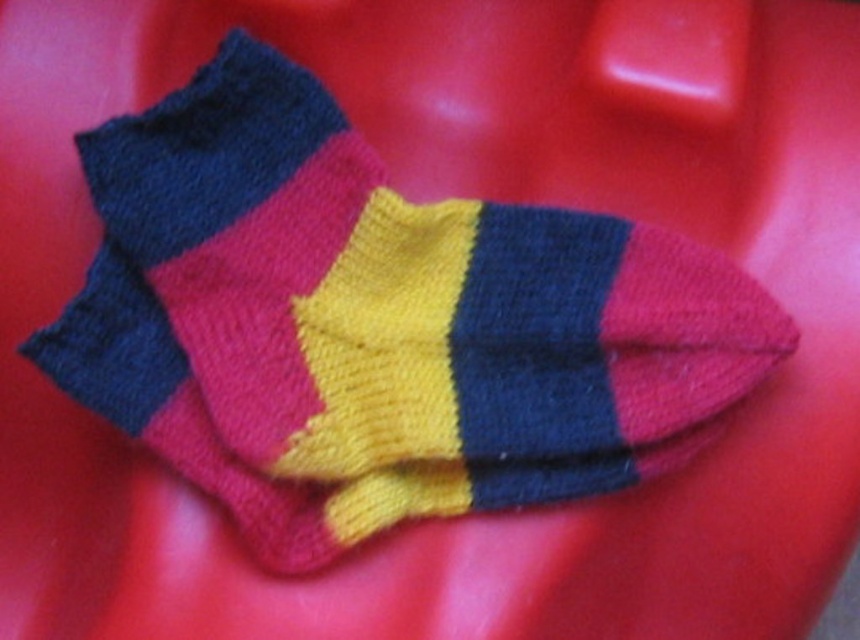
Question: Which object is farther from the camera taking this photo?

Choices:
 (A) knitted wool sock at center
 (B) knitted wool socks at center

Answer: (A)

Question: Among these points, which one is nearest to the camera?

Choices:
 (A) (468, 349)
 (B) (488, 474)

Answer: (A)

Question: Does knitted wool socks at center have a greater width compared to knitted wool sock at center?

Choices:
 (A) yes
 (B) no

Answer: (A)

Question: Is knitted wool socks at center closer to the viewer compared to knitted wool sock at center?

Choices:
 (A) yes
 (B) no

Answer: (A)

Question: Is knitted wool socks at center further to the viewer compared to knitted wool sock at center?

Choices:
 (A) no
 (B) yes

Answer: (A)